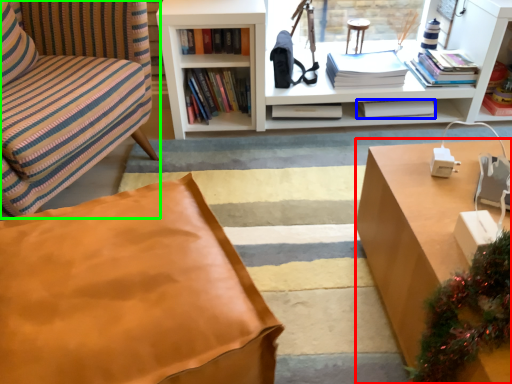
Question: Considering the real-world distances, which object is farthest from desk (highlighted by a red box)? book (highlighted by a blue box) or chair (highlighted by a green box)?

Choices:
 (A) book
 (B) chair

Answer: (B)